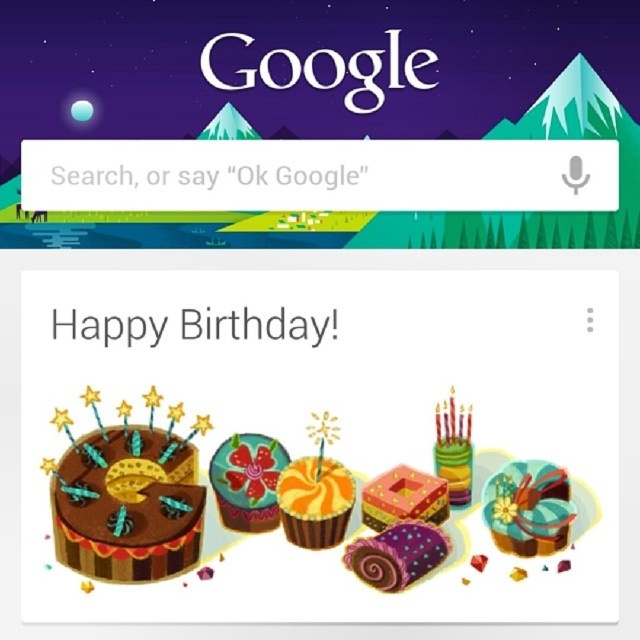
Consider the image. Does colorful paper cake at center lie in front of matte pink cake at center?

Yes, it is.

Between colorful paper cake at center and matte pink cake at center, which one is positioned higher?

colorful paper cake at center is above.

Who is more forward, (276, 301) or (378, 518)?

Point (378, 518)

What are the coordinates of `colorful paper cake at center` in the screenshot? It's located at (316, 429).

Is black paper text at center shorter than swirled orange cupcake at center?

Correct, black paper text at center is not as tall as swirled orange cupcake at center.

Which is below, black paper text at center or swirled orange cupcake at center?

swirled orange cupcake at center is below.

Who is more forward, (308, 332) or (312, 502)?

Point (312, 502)

At what (x,y) coordinates should I click in order to perform the action: click on black paper text at center. Please return your answer as a coordinate pair (x, y). Looking at the image, I should click on (257, 324).

Does swirled orange cupcake at center lie behind purple glossy cake at center?

Yes, it is behind purple glossy cake at center.

Is point (349, 500) positioned behind point (417, 531)?

Yes, it is.

Locate an element on the screen. This screenshot has width=640, height=640. swirled orange cupcake at center is located at coordinates 314,500.